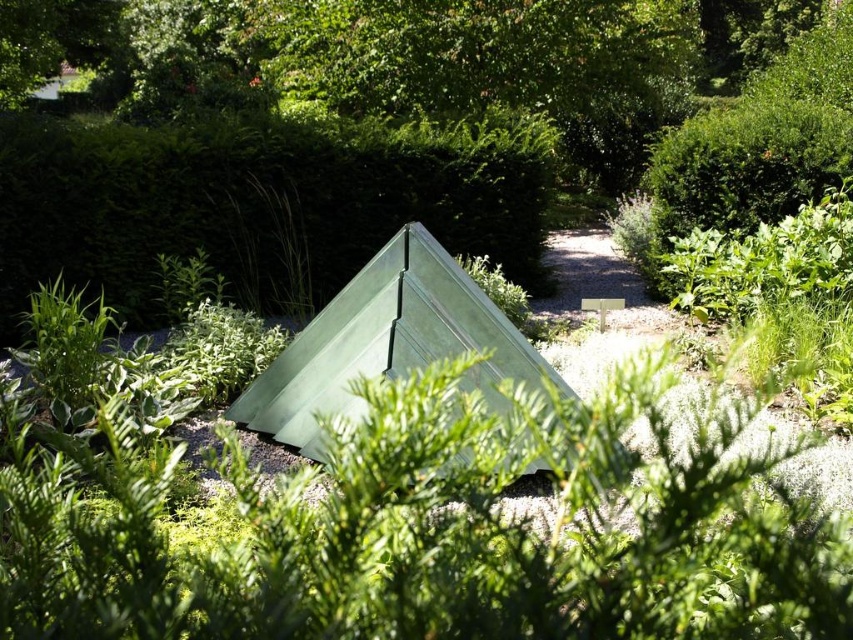
Who is more distant from viewer, (128, 269) or (392, 284)?

The point (128, 269) is behind.

Between green matte tent at center and green fabric tent at center, which one appears on the right side from the viewer's perspective?

green fabric tent at center

Locate an element on the screen. The height and width of the screenshot is (640, 853). green matte tent at center is located at coordinates click(254, 204).